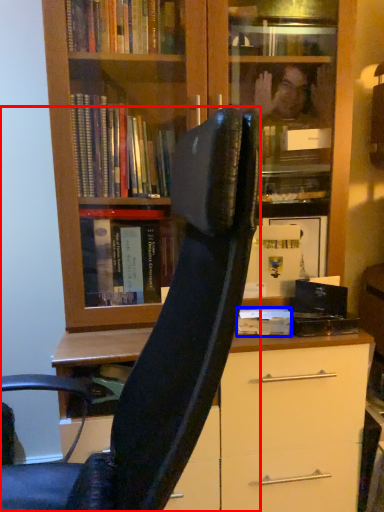
Question: Which object appears closest to the camera in this image, chair (highlighted by a red box) or paperback book (highlighted by a blue box)?

Choices:
 (A) chair
 (B) paperback book

Answer: (A)